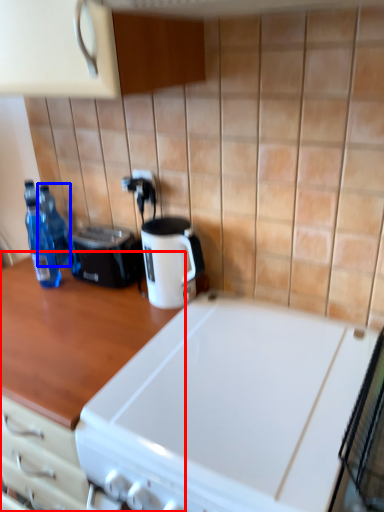
Question: Which object is further to the camera taking this photo, countertop (highlighted by a red box) or bottle (highlighted by a blue box)?

Choices:
 (A) countertop
 (B) bottle

Answer: (B)